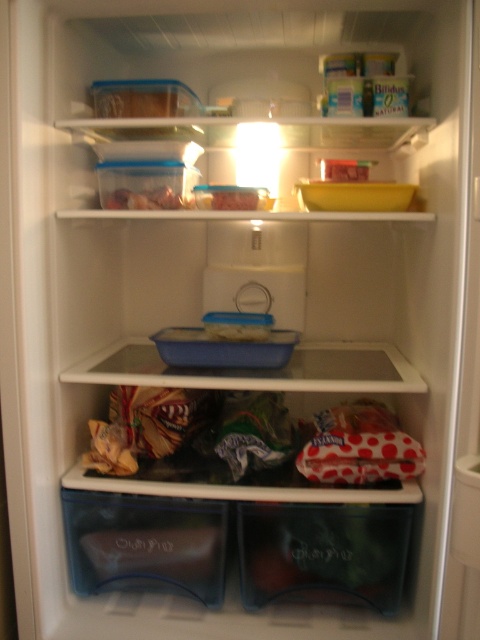
You are organizing the fridge and need to place a new item between the polka dot fabric bag at center and the translucent plastic container at upper center. Based on their positions, where should you place the new item?

The polka dot fabric bag at center is to the right of the translucent plastic container at upper center, so you should place the new item between them by positioning it to the left of the polka dot fabric bag at center and to the right of the translucent plastic container at upper center.

You are standing in front of the refrigerator and want to place a new item into the polka dot fabric bag at center. Considering your reach, can you easily access it without moving any other items?

The polka dot fabric bag at center is 3.85 feet away from camera, which is within typical reach distance for most people, so yes, you can easily access it without needing to move other items.

You are organizing items in a refrigerator and need to retrieve the translucent plastic container at upper center. However, the polka dot fabric bag at center is blocking your access. Can you move the bag to get to the container?

The polka dot fabric bag at center is in front of the translucent plastic container at upper center, so you can move the bag to access the container.